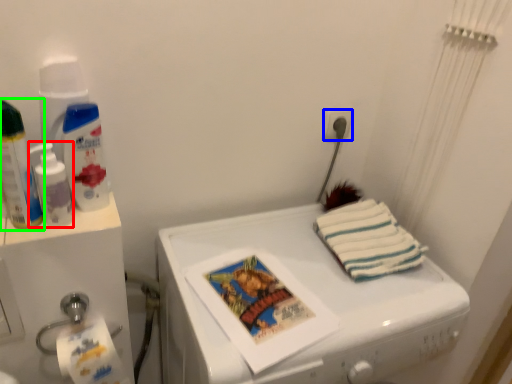
Question: Considering the real-world distances, which object is farthest from cleaning product (highlighted by a red box)? power plugs and sockets (highlighted by a blue box) or bottle (highlighted by a green box)?

Choices:
 (A) power plugs and sockets
 (B) bottle

Answer: (A)